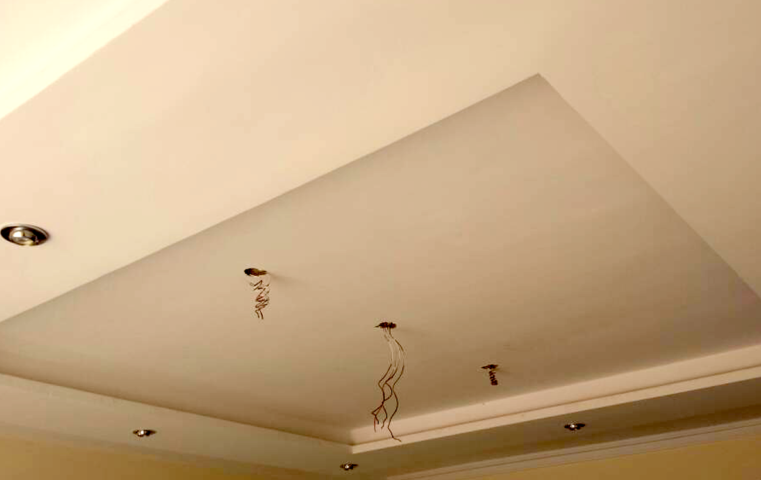
This screenshot has width=761, height=480. What are the coordinates of `yellow wall right` in the screenshot? It's located at (x=673, y=468).